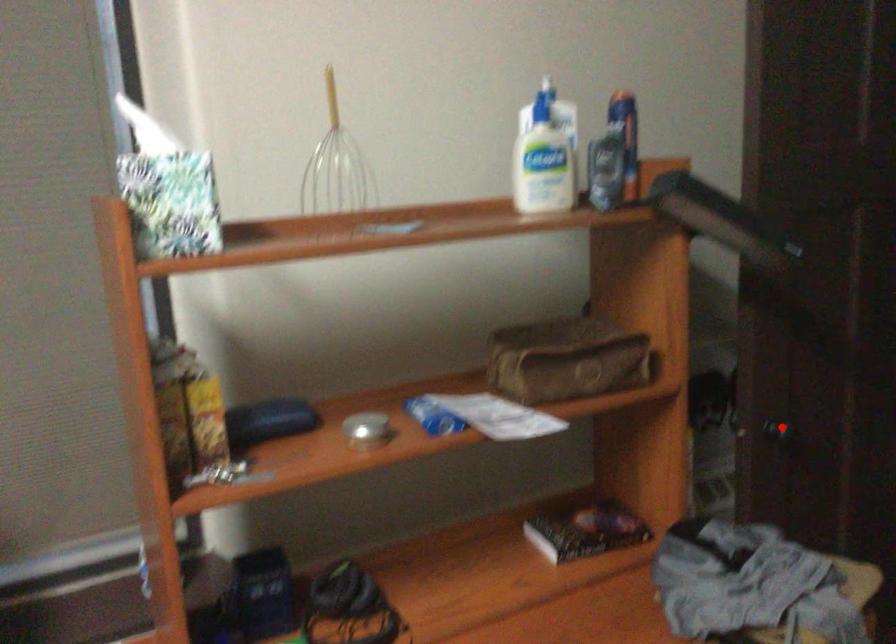
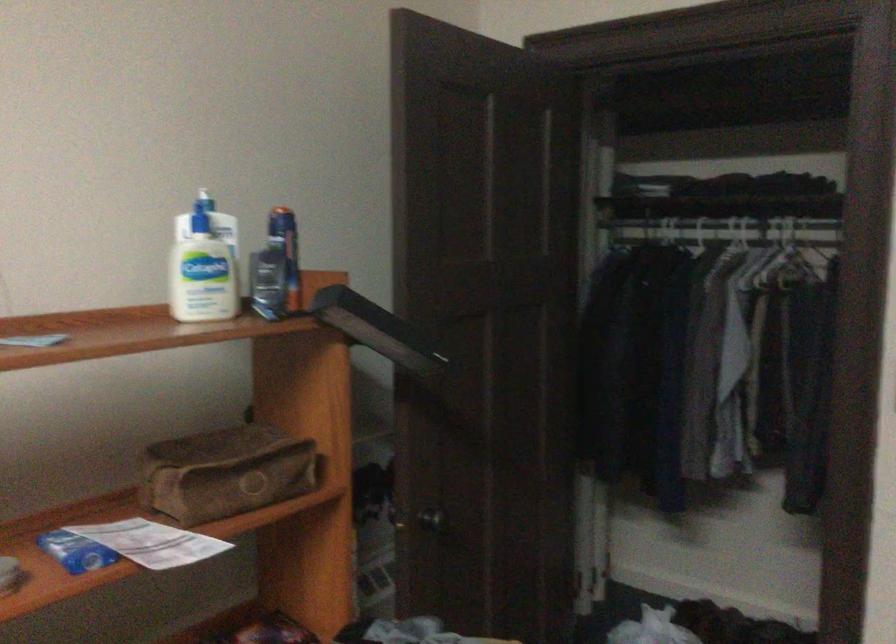
Where in the second image is the point corresponding to the highlighted location from the first image?

(433, 520)